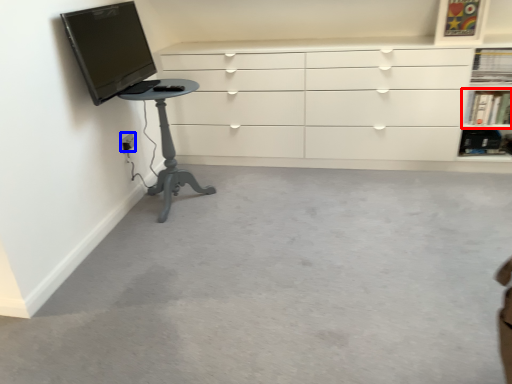
Question: Which object appears closest to the camera in this image, shelf (highlighted by a red box) or electric outlet (highlighted by a blue box)?

Choices:
 (A) shelf
 (B) electric outlet

Answer: (B)